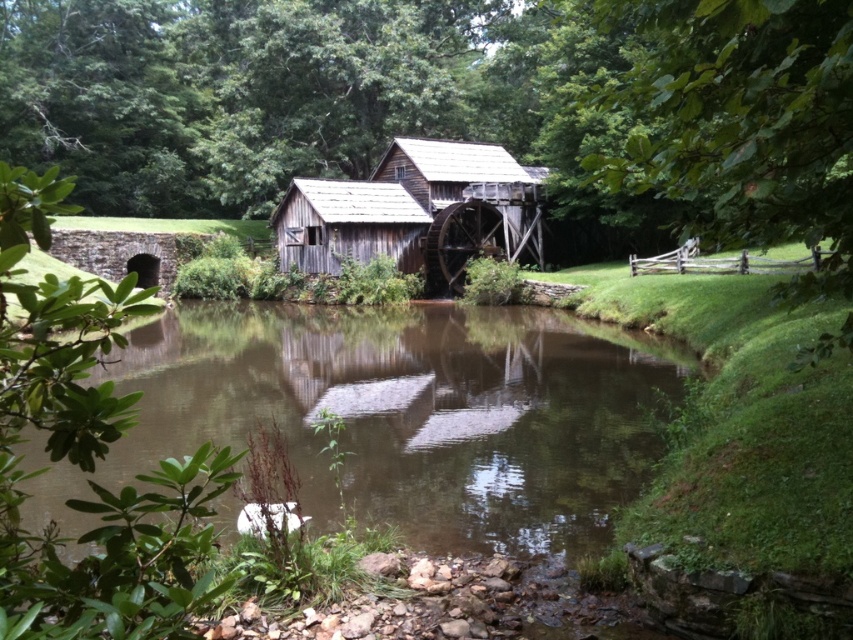
Question: Which point appears closest to the camera in this image?

Choices:
 (A) (531, 252)
 (B) (236, 381)

Answer: (B)

Question: Can you confirm if brown reflective water at center is wider than green leafy tree at right?

Choices:
 (A) no
 (B) yes

Answer: (B)

Question: Can you confirm if green leafy tree at right is thinner than weathered wood barn at center?

Choices:
 (A) no
 (B) yes

Answer: (B)

Question: Which point is closer to the camera?

Choices:
 (A) 811,205
 (B) 281,268
 (C) 390,467

Answer: (A)

Question: Which of these objects is positioned farthest from the weathered wood barn at center?

Choices:
 (A) green leafy tree at right
 (B) brown reflective water at center

Answer: (A)

Question: From the image, what is the correct spatial relationship of brown reflective water at center in relation to weathered wood barn at center?

Choices:
 (A) right
 (B) left

Answer: (B)